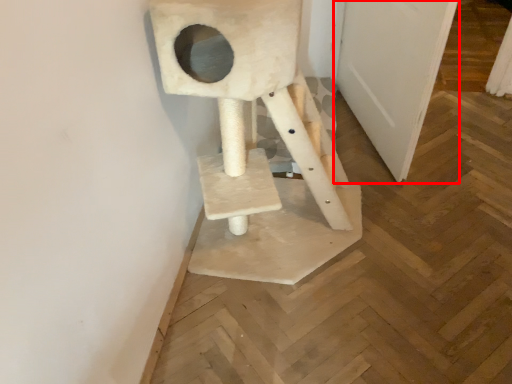
Question: From the image's perspective, considering the relative positions of door (annotated by the red box) and sculpture in the image provided, where is door (annotated by the red box) located with respect to the staircase?

Choices:
 (A) below
 (B) above

Answer: (B)